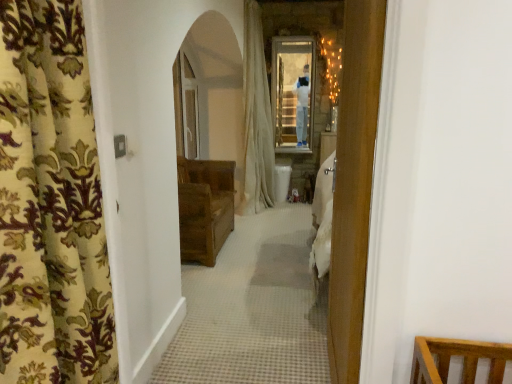
Question: Is the position of white fabric curtain at center, the 2th curtain from the left, more distant than that of brown wooden chest at center?

Choices:
 (A) no
 (B) yes

Answer: (B)

Question: Is white fabric curtain at center, acting as the 2th curtain starting from the front, positioned far away from brown wooden chest at center?

Choices:
 (A) no
 (B) yes

Answer: (B)

Question: Considering the relative sizes of white fabric curtain at center, the first curtain from the back, and brown wooden chest at center in the image provided, is white fabric curtain at center, the first curtain from the back, shorter than brown wooden chest at center?

Choices:
 (A) yes
 (B) no

Answer: (B)

Question: Is white fabric curtain at center, the 2th curtain from the left, bigger than brown wooden chest at center?

Choices:
 (A) yes
 (B) no

Answer: (A)

Question: Can you confirm if white fabric curtain at center, the 2th curtain from the left, is taller than brown wooden chest at center?

Choices:
 (A) no
 (B) yes

Answer: (B)

Question: Considering their positions, is brown wooden chest at center located in front of or behind white fabric curtain at center, the first curtain from the back?

Choices:
 (A) behind
 (B) front

Answer: (B)

Question: Choose the correct answer: Is brown wooden chest at center inside white fabric curtain at center, arranged as the first curtain when viewed from the right, or outside it?

Choices:
 (A) outside
 (B) inside

Answer: (A)

Question: From the image's perspective, is brown wooden chest at center located above or below white fabric curtain at center, arranged as the first curtain when viewed from the right?

Choices:
 (A) above
 (B) below

Answer: (B)

Question: Looking at their shapes, would you say brown wooden chest at center is wider or thinner than white fabric curtain at center, the first curtain from the back?

Choices:
 (A) wide
 (B) thin

Answer: (A)

Question: Considering the relative positions of white fabric curtain at center, acting as the 2th curtain starting from the front, and brown wooden chest at center in the image provided, is white fabric curtain at center, acting as the 2th curtain starting from the front, to the left or to the right of brown wooden chest at center?

Choices:
 (A) right
 (B) left

Answer: (A)

Question: In terms of height, does white fabric curtain at center, the first curtain from the back, look taller or shorter compared to brown wooden chest at center?

Choices:
 (A) short
 (B) tall

Answer: (B)

Question: Considering the positions of white fabric curtain at center, acting as the 2th curtain starting from the front, and brown wooden chest at center in the image, is white fabric curtain at center, acting as the 2th curtain starting from the front, bigger or smaller than brown wooden chest at center?

Choices:
 (A) small
 (B) big

Answer: (B)

Question: From the image's perspective, is white fabric curtain at center, acting as the 2th curtain starting from the front, located above or below brown wooden chest at center?

Choices:
 (A) above
 (B) below

Answer: (A)

Question: Looking at their shapes, would you say floral fabric curtain at left, which is the second curtain in back-to-front order, is wider or thinner than white fabric curtain at center, acting as the 2th curtain starting from the front?

Choices:
 (A) wide
 (B) thin

Answer: (B)

Question: Would you say floral fabric curtain at left, placed as the 1th curtain when sorted from front to back, is to the left or to the right of white fabric curtain at center, acting as the 2th curtain starting from the front, in the picture?

Choices:
 (A) right
 (B) left

Answer: (B)